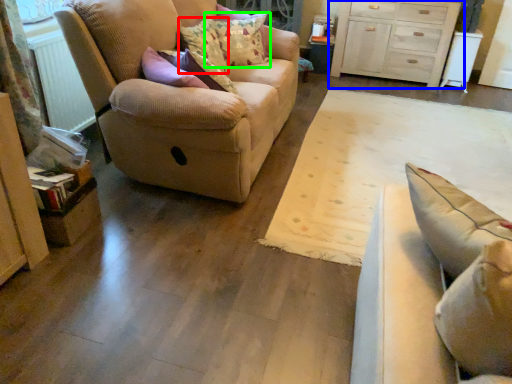
Question: Which object is the closest to the pillow (highlighted by a red box)? Choose among these: chest of drawers (highlighted by a blue box) or pillow (highlighted by a green box).

Choices:
 (A) chest of drawers
 (B) pillow

Answer: (B)